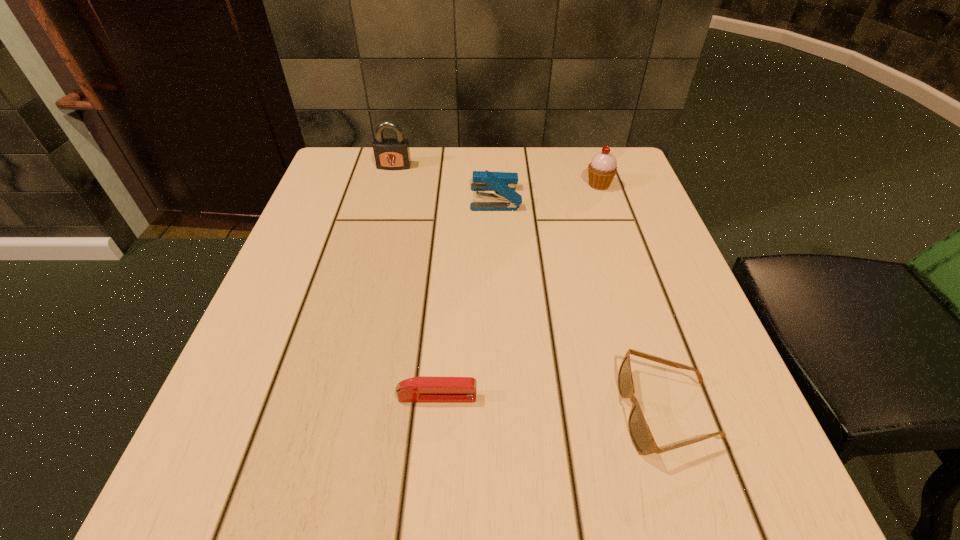
You are a GUI agent. You are given a task and a screenshot of the screen. Output one action in this format:
    pyautogui.click(x=<x>, y=<y>)
    Task: Click on the free region located on the frames of the fourth tallest object
    
    Given the screenshot: What is the action you would take?
    pyautogui.click(x=363, y=412)

Find the location of a particular element. The height and width of the screenshot is (540, 960). vacant space located on the frames of the fourth tallest object is located at coordinates (517, 412).

This screenshot has width=960, height=540. Identify the location of vacant space situated 0.210m on the frames of the fourth tallest object. (475, 412).

Where is `blank space located on the front-facing side of the shorter stapler`? Image resolution: width=960 pixels, height=540 pixels. blank space located on the front-facing side of the shorter stapler is located at coordinates (683, 397).

Image resolution: width=960 pixels, height=540 pixels. In order to click on padlock positioned at the far edge in this screenshot , I will do `click(390, 153)`.

The height and width of the screenshot is (540, 960). Identify the location of cupcake that is at the far edge. (603, 167).

You are a GUI agent. You are given a task and a screenshot of the screen. Output one action in this format:
    pyautogui.click(x=<x>, y=<y>)
    Task: Click on the stapler present at the far edge
    The width and height of the screenshot is (960, 540).
    Given the screenshot: What is the action you would take?
    pyautogui.click(x=502, y=183)

The width and height of the screenshot is (960, 540). In order to click on object situated at the near edge in this screenshot , I will do click(x=640, y=434).

You are a GUI agent. You are given a task and a screenshot of the screen. Output one action in this format:
    pyautogui.click(x=<x>, y=<y>)
    Task: Click on the object that is at the left edge
    This screenshot has height=540, width=960.
    Given the screenshot: What is the action you would take?
    pyautogui.click(x=390, y=153)

I want to click on cupcake at the right edge, so click(x=603, y=167).